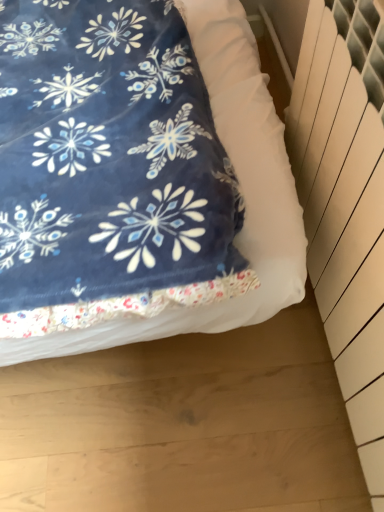
Question: Relative to velvety blue blanket at upper left, is white plastic radiator at right in front or behind?

Choices:
 (A) behind
 (B) front

Answer: (B)

Question: Is point (329, 117) positioned closer to the camera than point (286, 211)?

Choices:
 (A) farther
 (B) closer

Answer: (A)

Question: From a real-world perspective, is white plastic radiator at right positioned above or below velvety blue blanket at upper left?

Choices:
 (A) below
 (B) above

Answer: (B)

Question: Is velvety blue blanket at upper left to the left or to the right of white plastic radiator at right in the image?

Choices:
 (A) right
 (B) left

Answer: (B)

Question: Considering the positions of point (225, 19) and point (309, 118), is point (225, 19) closer or farther from the camera than point (309, 118)?

Choices:
 (A) closer
 (B) farther

Answer: (B)

Question: Considering their positions, is velvety blue blanket at upper left located in front of or behind white plastic radiator at right?

Choices:
 (A) front
 (B) behind

Answer: (B)

Question: Considering the positions of velvety blue blanket at upper left and white plastic radiator at right in the image, is velvety blue blanket at upper left wider or thinner than white plastic radiator at right?

Choices:
 (A) thin
 (B) wide

Answer: (B)